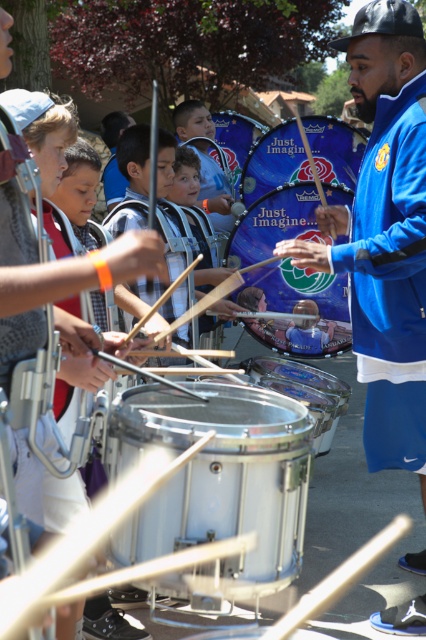
You are a photographer trying to capture a clear shot of both the blue drum at center and the blue fabric drum at center. Since you want both to be visible in your photo, which one should you focus on first to ensure it appears sharp in the foreground?

The blue drum at center is below blue fabric drum at center, so you should focus on the blue fabric drum at center first to ensure it appears sharp in the foreground.

You are a photographer trying to capture a photo of the shiny silver drum at center. There is a child wearing the blue fabric jacket at center in front of it. Based on the scene description, can you determine if the jacket will block the view of the drum in your photo?

The blue fabric jacket at center is taller than the shiny silver drum at center, so the jacket will block the view of the drum in the photo.